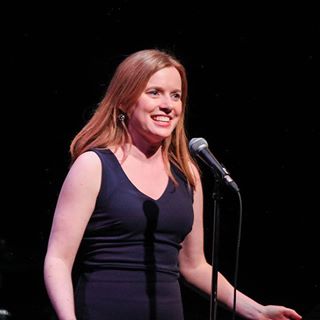
At what (x,y) coordinates should I click in order to perform the action: click on stand. Please return your answer as a coordinate pair (x, y). Image resolution: width=320 pixels, height=320 pixels. Looking at the image, I should click on (213, 297).